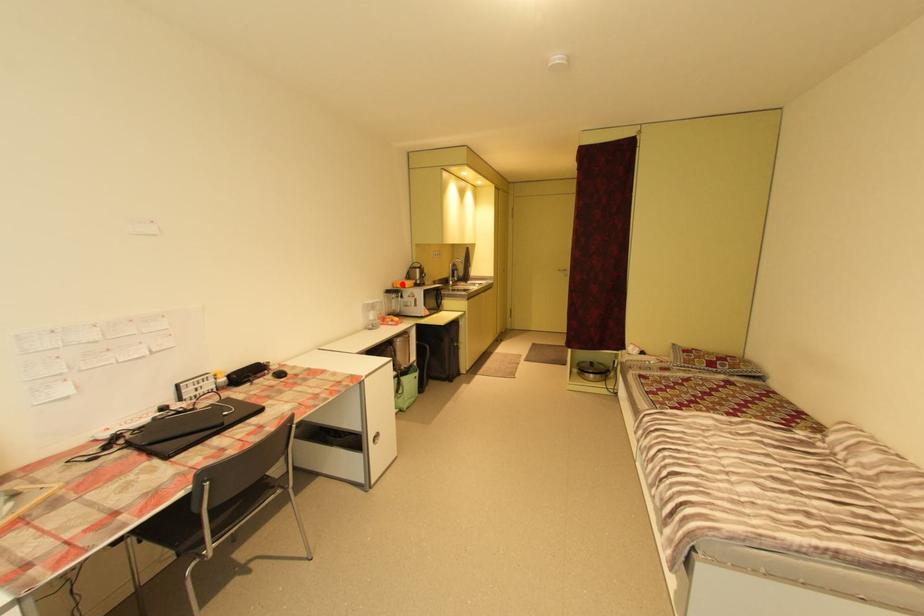
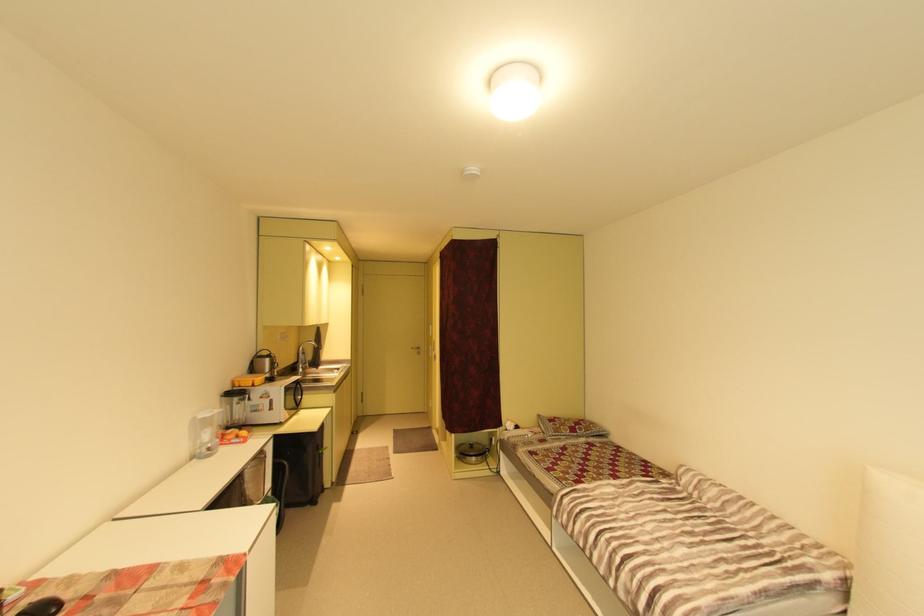
In the second image, find the point that corresponds to the highlighted location in the first image.

(246, 381)